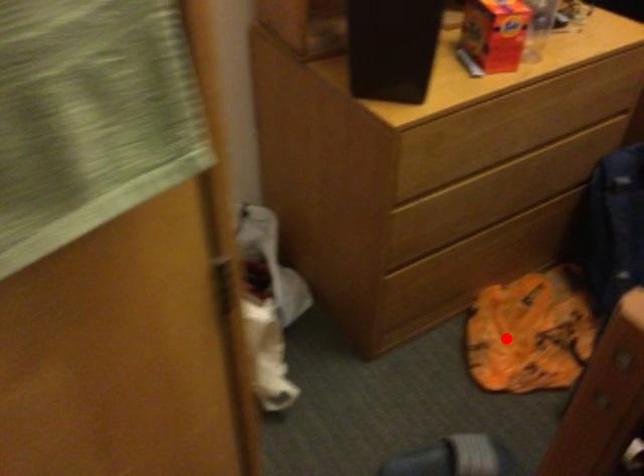
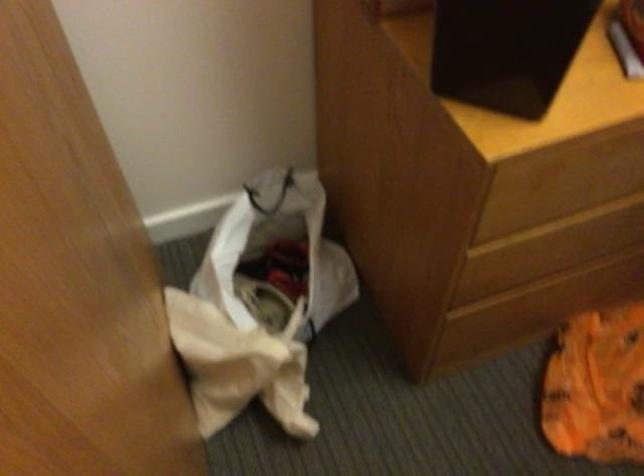
Find the pixel in the second image that matches the highlighted location in the first image.

(597, 386)